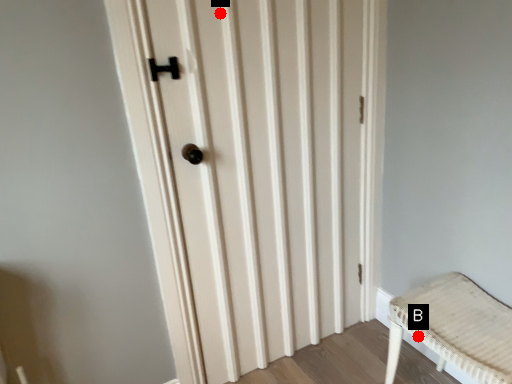
Question: Two points are circled on the image, labeled by A and B beside each circle. Which point is farther to the camera?

Choices:
 (A) A is further
 (B) B is further

Answer: (B)